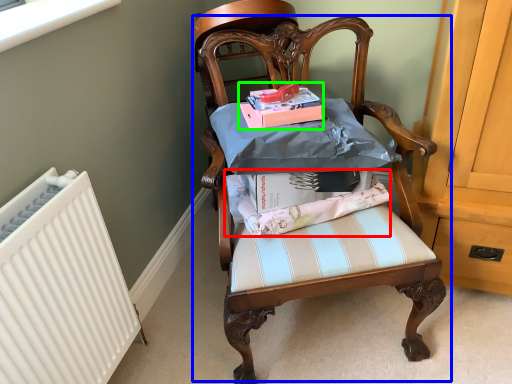
Question: Based on their relative distances, which object is nearer to fabric (highlighted by a red box)? Choose from chair (highlighted by a blue box) and magazine (highlighted by a green box).

Choices:
 (A) chair
 (B) magazine

Answer: (A)